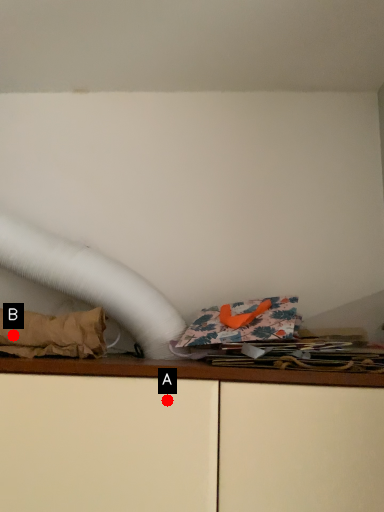
Question: Two points are circled on the image, labeled by A and B beside each circle. Which point is closer to the camera?

Choices:
 (A) A is closer
 (B) B is closer

Answer: (A)